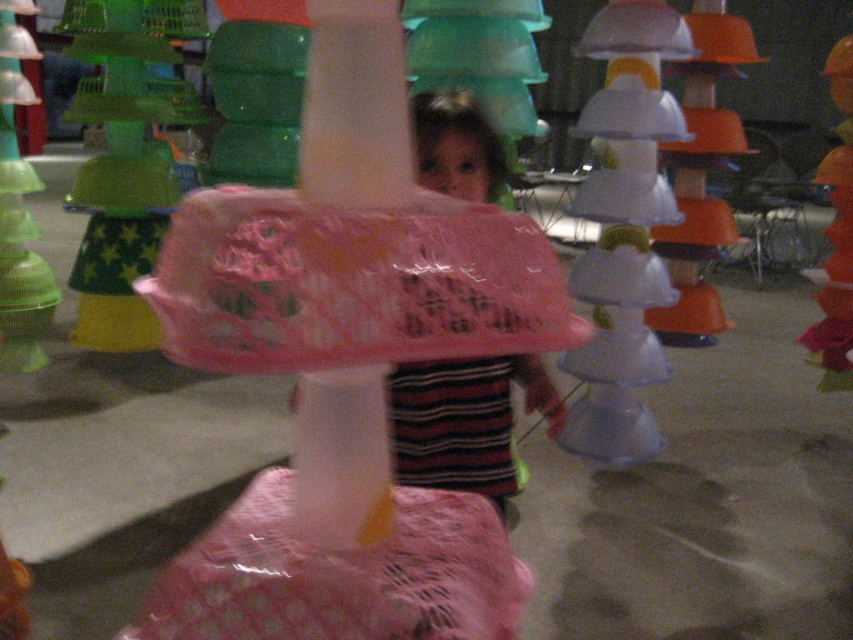
You are a child looking for a toy in the playroom. You see the pink lace umbrella at center and the orange matte toy at right. Which toy is located to the right side of the other?

The orange matte toy at right is located to the right side of the pink lace umbrella at center.